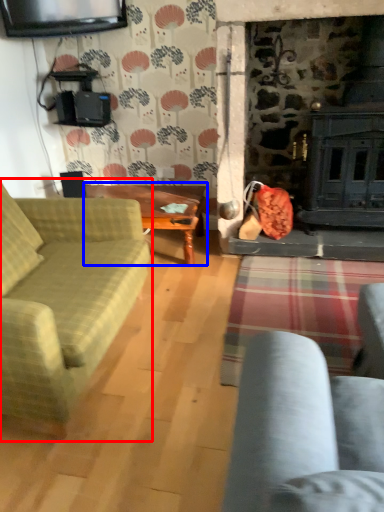
Question: Which object is closer to the camera taking this photo, studio couch (highlighted by a red box) or table (highlighted by a blue box)?

Choices:
 (A) studio couch
 (B) table

Answer: (A)